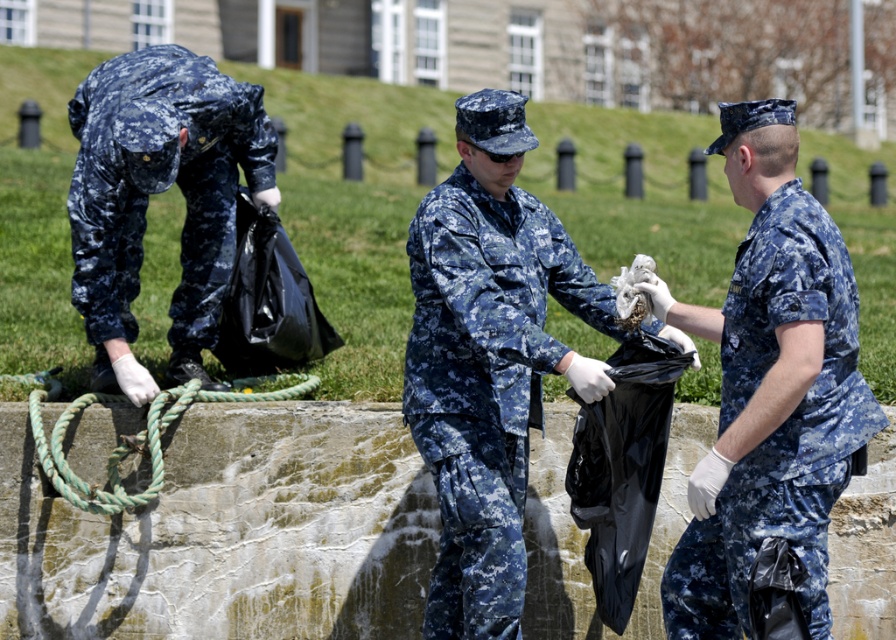
You are a photographer trying to capture a clear shot of the digital camouflage uniform at right and the green rough rope at center. Which object is positioned lower in the frame?

The digital camouflage uniform at right is located below the green rough rope at center, so it is positioned lower in the frame.

You are a drone operator trying to locate a specific point in the image. The point is at coordinates point (487, 378). According to the scene description, where would this point be located?

The point (487, 378) is on the camouflage fabric uniform at center.